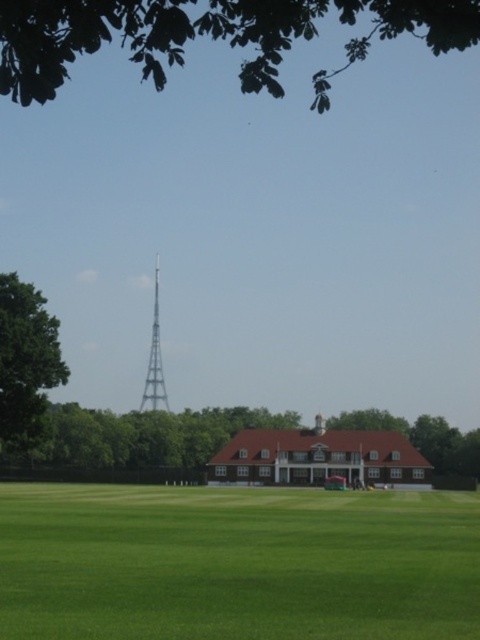
Between green grass at lower center and green leafy tree at lower center, which one appears on the left side from the viewer's perspective?

green leafy tree at lower center is more to the left.

This screenshot has height=640, width=480. Identify the location of green grass at lower center. (237, 563).

Locate an element on the screen. The image size is (480, 640). green grass at lower center is located at coordinates (237, 563).

Does green grass at lower center appear on the left side of green leafy tree at upper center?

Yes, green grass at lower center is to the left of green leafy tree at upper center.

Is point (240, 616) closer to viewer compared to point (434, 48)?

No, (240, 616) is behind (434, 48).

The width and height of the screenshot is (480, 640). What are the coordinates of `green grass at lower center` in the screenshot? It's located at (237, 563).

Can you confirm if green grass at lower center is taller than silver metallic tower at center?

No, green grass at lower center is not taller than silver metallic tower at center.

Can you confirm if green grass at lower center is smaller than silver metallic tower at center?

No, green grass at lower center is not smaller than silver metallic tower at center.

Who is more distant from viewer, (447, 532) or (149, 353)?

Positioned behind is point (149, 353).

This screenshot has height=640, width=480. Find the location of `green grass at lower center`. green grass at lower center is located at coordinates (237, 563).